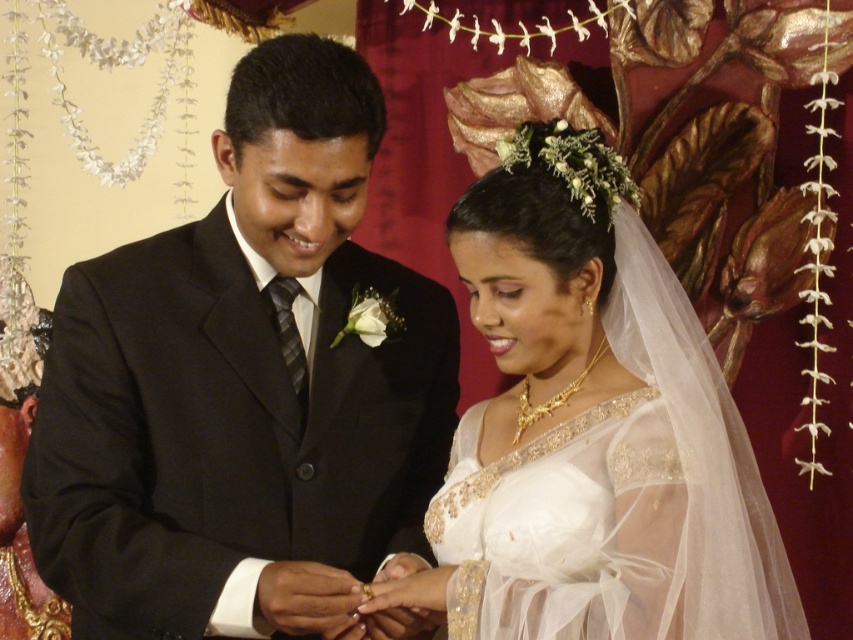
Question: Which of the following is the closest to the observer?

Choices:
 (A) (314, 106)
 (B) (727, 618)

Answer: (A)

Question: Which point is closer to the camera taking this photo?

Choices:
 (A) (364, 592)
 (B) (527, 579)

Answer: (B)

Question: Estimate the real-world distances between objects in this image. Which object is closer to the white sheer dress at center?

Choices:
 (A) white sheer fabric dress at center
 (B) gold shiny ring at center

Answer: (A)

Question: Is black satin suit at center positioned at the back of white sheer fabric dress at center?

Choices:
 (A) no
 (B) yes

Answer: (B)

Question: Is white sheer dress at center to the left of gold shiny ring at center from the viewer's perspective?

Choices:
 (A) no
 (B) yes

Answer: (A)

Question: Considering the relative positions of white sheer dress at center and gold shiny ring at center in the image provided, where is white sheer dress at center located with respect to gold shiny ring at center?

Choices:
 (A) left
 (B) right

Answer: (B)